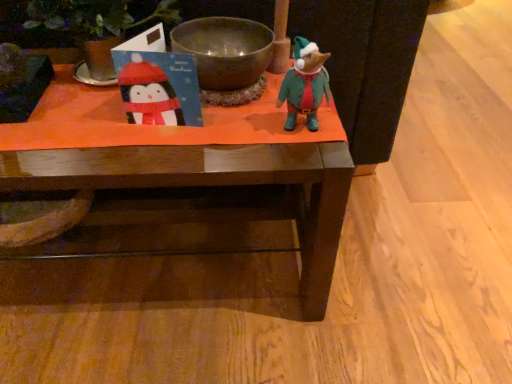
Find the location of `vacant area that is in front of shiny metallic bowl at center`. vacant area that is in front of shiny metallic bowl at center is located at coordinates (209, 145).